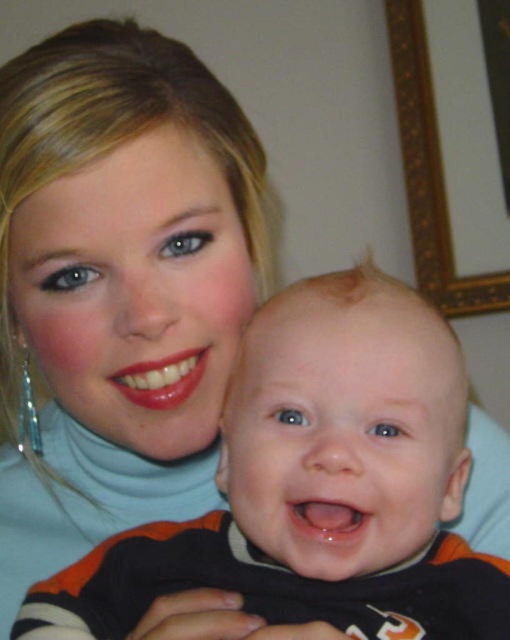
You are an interior designer planning to place a new painting on the wall between the black cotton onesie at center and the gold ornate frame at upper right. Which object should the painting be placed closer to if you want it to be closer to the shorter object?

The painting should be placed closer to the black cotton onesie at center because it is shorter than the gold ornate frame at upper right.

You are an interior designer assessing the placement of items in a nursery. You notice the black cotton onesie at center and the gold ornate frame at upper right. Which object is positioned closer to the observer?

The black cotton onesie at center is closer to the viewer than the gold ornate frame at upper right.

You are a photographer taking a portrait of the baby wearing the black cotton onesie at center. You want to ensure the onesie is in sharp focus while keeping the woman in the background slightly blurred. Based on the distance between the onesie and the camera, what is the minimum focusing distance you should set on your camera?

The black cotton onesie at center is 36.62 centimeters away from camera, so you should set the minimum focusing distance to at least 36.62 centimeters to ensure the onesie is in focus while keeping the woman in the background blurred.